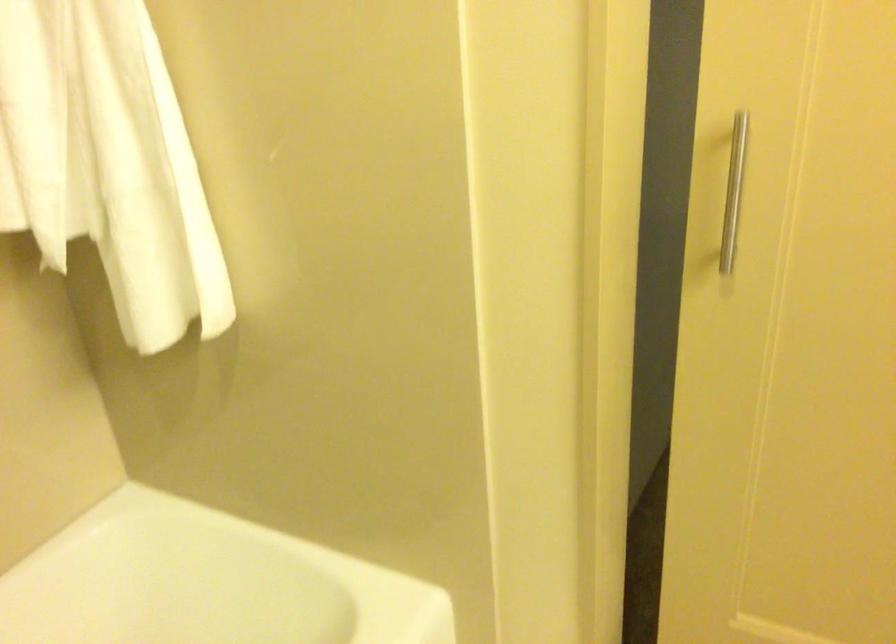
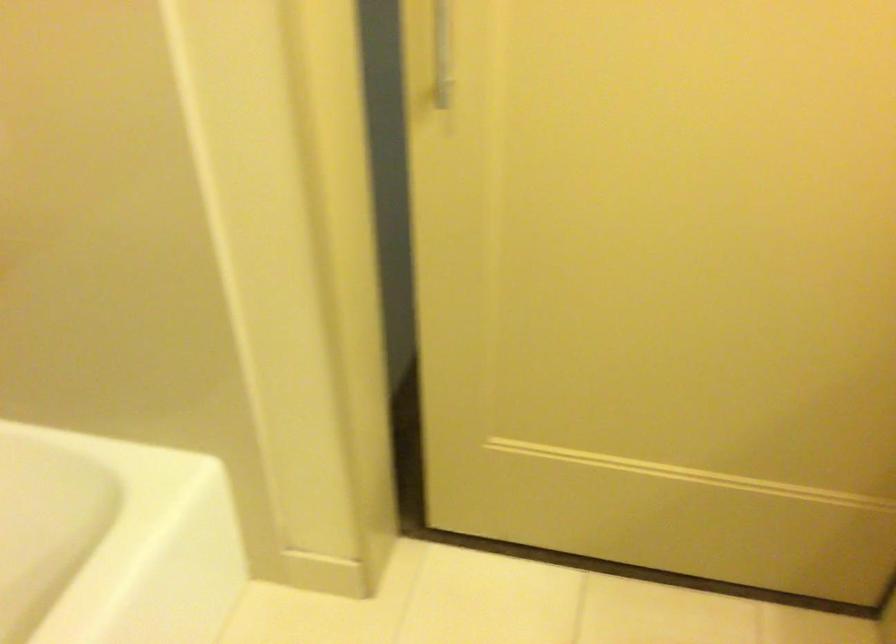
What movement of the cameraman would produce the second image?

The cameraman walked toward right, backward.